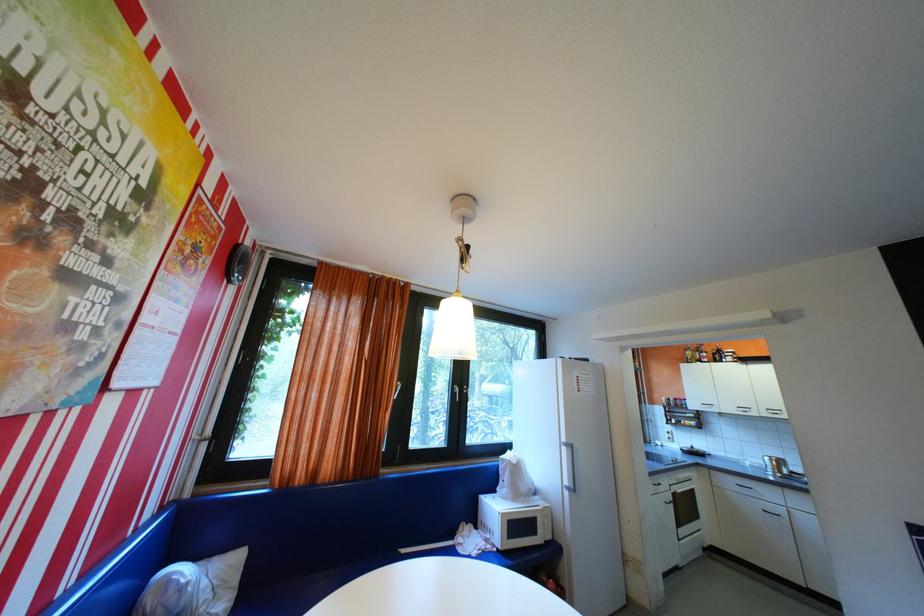
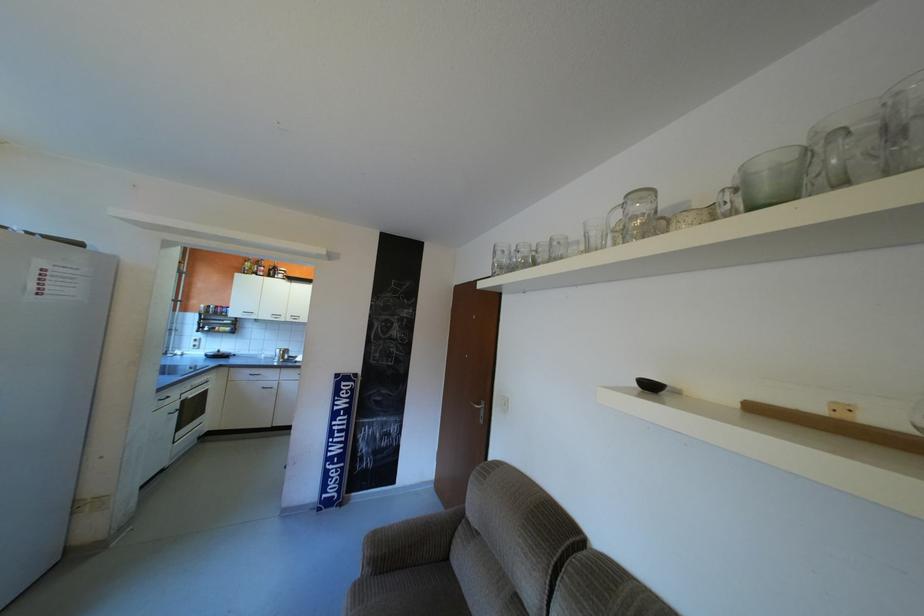
In the second image, find the point that corresponds to the point at 776,413 in the first image.

(300, 318)